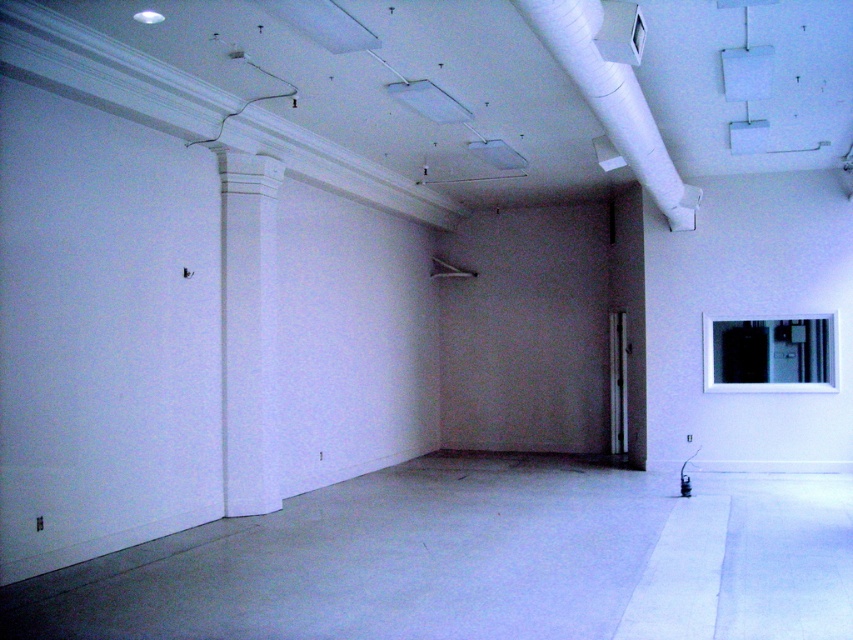
You are an interior designer planning to install a new light fixture. You have two options available for placement in the room described. The first option is to place it near the white smooth column at left, and the second is near the white matte pipe at upper center. Considering their heights, which location would allow the light fixture to be placed higher up?

The white smooth column at left has a greater height compared to the white matte pipe at upper center, so placing the light fixture near the white smooth column at left would allow it to be placed higher up.

You are standing in the center of the room and want to move towards the wall with the window or mirror. Which direction should you go relative to the white smooth column at left?

To move towards the wall with the window or mirror, you should head to the right side of the white smooth column at left since the window is on the right wall and the column is on the left side of the room.

From the picture: You are an interior designer planning to place a large sculpture between the white smooth column at left and the white matte pipe at upper center. Based on their widths, which object should you consider for placement compatibility?

The white smooth column at left might be wider than the white matte pipe at upper center, so the sculpture should be placed near the column to accommodate its width.